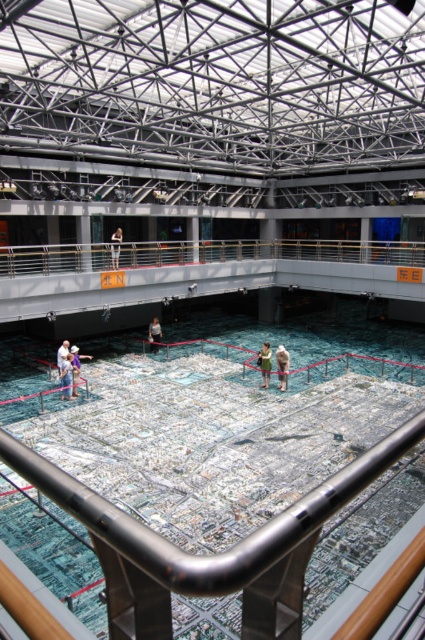
Question: Considering the relative positions of denim pants at lower left and white cotton dress at center in the image provided, where is denim pants at lower left located with respect to white cotton dress at center?

Choices:
 (A) below
 (B) above

Answer: (A)

Question: Does white paper map at center have a smaller size compared to white cotton dress at center?

Choices:
 (A) no
 (B) yes

Answer: (A)

Question: Among these objects, which one is nearest to the camera?

Choices:
 (A) white cotton shirt at lower left
 (B) white paper map at center
 (C) denim pants at lower left

Answer: (B)

Question: Which point appears farthest from the camera in this image?

Choices:
 (A) (116, 246)
 (B) (274, 456)
 (C) (289, 356)
 (D) (67, 388)

Answer: (A)

Question: Considering the real-world distances, which object is farthest from the light brown leather jacket at center?

Choices:
 (A) light brown fabric shirt at center
 (B) white paper map at center
 (C) denim pants at lower left
 (D) light brown fabric bag at center

Answer: (B)

Question: From the image, what is the correct spatial relationship of white paper map at center in relation to white cotton shirt at lower left?

Choices:
 (A) above
 (B) below

Answer: (B)